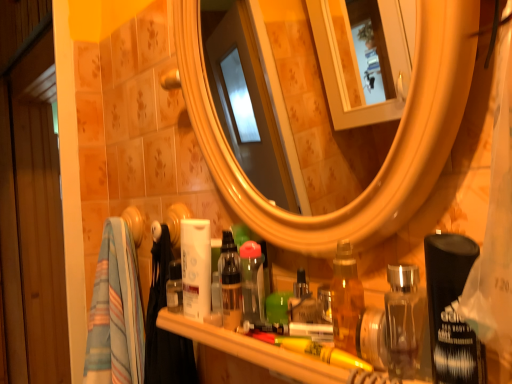
This screenshot has height=384, width=512. Identify the location of free space above translucent plastic items at lower center (from a real-world perspective). (279, 332).